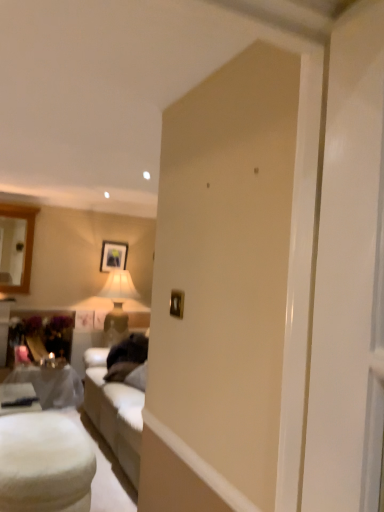
This screenshot has width=384, height=512. Identify the location of white fluffy ottoman at lower left, which is the first table from front to back. (44, 463).

The image size is (384, 512). In order to click on matte black picture frame at upper center, which ranks as the 2th picture frame in right-to-left order in this screenshot , I will do 113,256.

What are the coordinates of `white fluffy ottoman at lower left, which is counted as the 2th table, starting from the back` in the screenshot? It's located at (44, 463).

Based on the photo, from the image's perspective, does metallic gold picture frame at center, arranged as the 1th picture frame when viewed from the front, appear lower than matte black picture frame at upper center, which is the 1th picture frame in left-to-right order?

Yes, from the image's perspective, metallic gold picture frame at center, arranged as the 1th picture frame when viewed from the front, is below matte black picture frame at upper center, which is the 1th picture frame in left-to-right order.

Is metallic gold picture frame at center, which is the first picture frame in right-to-left order, outside of matte black picture frame at upper center, which ranks as the 2th picture frame in right-to-left order?

Yes, metallic gold picture frame at center, which is the first picture frame in right-to-left order, is located beyond the bounds of matte black picture frame at upper center, which ranks as the 2th picture frame in right-to-left order.

Is metallic gold picture frame at center, placed as the 2th picture frame when sorted from back to front, not near matte black picture frame at upper center, positioned as the 2th picture frame in front-to-back order?

Yes.

Considering the sizes of objects metallic gold picture frame at center, which is the first picture frame in right-to-left order, and matte black picture frame at upper center, the 1th picture frame from the back, in the image provided, who is wider, metallic gold picture frame at center, which is the first picture frame in right-to-left order, or matte black picture frame at upper center, the 1th picture frame from the back,?

With larger width is matte black picture frame at upper center, the 1th picture frame from the back.

Is matte black picture frame at upper center, which is the 1th picture frame in left-to-right order, in contact with matte gray table at lower left, the first table viewed from the back?

There is a gap between matte black picture frame at upper center, which is the 1th picture frame in left-to-right order, and matte gray table at lower left, the first table viewed from the back.

What's the angular difference between matte black picture frame at upper center, which ranks as the 2th picture frame in right-to-left order, and matte gray table at lower left, the first table viewed from the back,'s facing directions?

0.02 degrees.

From a real-world perspective, between matte black picture frame at upper center, the 1th picture frame from the back, and matte gray table at lower left, acting as the second table starting from the front, who is vertically lower?

In real-world perspective, matte gray table at lower left, acting as the second table starting from the front, is lower.

From the picture: Which point is more distant from viewer, (109, 254) or (24, 373)?

The point (109, 254) is behind.

Does white fluffy ottoman at lower left, which is the first table from front to back, have a larger size compared to matte gray table at lower left, acting as the second table starting from the front?

No, white fluffy ottoman at lower left, which is the first table from front to back, is not bigger than matte gray table at lower left, acting as the second table starting from the front.

Which of these two, white fluffy ottoman at lower left, which is counted as the 2th table, starting from the back, or matte gray table at lower left, acting as the second table starting from the front, stands taller?

matte gray table at lower left, acting as the second table starting from the front.

Between white fluffy ottoman at lower left, which is counted as the 2th table, starting from the back, and matte gray table at lower left, acting as the second table starting from the front, which one appears on the right side from the viewer's perspective?

white fluffy ottoman at lower left, which is counted as the 2th table, starting from the back, is more to the right.

Choose the correct answer: Is white fluffy ottoman at lower left, which is counted as the 2th table, starting from the back, inside matte gray table at lower left, the first table viewed from the back, or outside it?

white fluffy ottoman at lower left, which is counted as the 2th table, starting from the back, is not enclosed by matte gray table at lower left, the first table viewed from the back.

Is metallic gold picture frame at center, arranged as the 1th picture frame when viewed from the front, beside matte gray table at lower left, acting as the second table starting from the front?

metallic gold picture frame at center, arranged as the 1th picture frame when viewed from the front, and matte gray table at lower left, acting as the second table starting from the front, are clearly separated.

Can you confirm if metallic gold picture frame at center, placed as the 2th picture frame when sorted from left to right, is positioned to the left of matte gray table at lower left, the first table viewed from the back?

No, metallic gold picture frame at center, placed as the 2th picture frame when sorted from left to right, is not to the left of matte gray table at lower left, the first table viewed from the back.

Does metallic gold picture frame at center, placed as the 2th picture frame when sorted from back to front, have a lesser height compared to matte gray table at lower left, acting as the second table starting from the front?

Yes.

Which is behind, point (172, 294) or point (9, 373)?

The point (9, 373) is farther.

Considering the relative sizes of matte gray table at lower left, acting as the second table starting from the front, and matte black picture frame at upper center, positioned as the 2th picture frame in front-to-back order, in the image provided, is matte gray table at lower left, acting as the second table starting from the front, wider than matte black picture frame at upper center, positioned as the 2th picture frame in front-to-back order,?

Yes.

Considering the positions of objects matte gray table at lower left, acting as the second table starting from the front, and matte black picture frame at upper center, the 1th picture frame from the back, in the image provided, who is behind, matte gray table at lower left, acting as the second table starting from the front, or matte black picture frame at upper center, the 1th picture frame from the back,?

Positioned behind is matte black picture frame at upper center, the 1th picture frame from the back.

Which is more to the left, matte gray table at lower left, the first table viewed from the back, or matte black picture frame at upper center, which ranks as the 2th picture frame in right-to-left order?

matte gray table at lower left, the first table viewed from the back, is more to the left.

Which is closer, (x=79, y=382) or (x=112, y=254)?

The point (x=79, y=382) is more forward.

Based on the photo, does matte gray table at lower left, acting as the second table starting from the front, have a lesser width compared to white fluffy ottoman at lower left, which is counted as the 2th table, starting from the back?

Incorrect, the width of matte gray table at lower left, acting as the second table starting from the front, is not less than that of white fluffy ottoman at lower left, which is counted as the 2th table, starting from the back.

Measure the distance from matte gray table at lower left, acting as the second table starting from the front, to white fluffy ottoman at lower left, which is counted as the 2th table, starting from the back.

matte gray table at lower left, acting as the second table starting from the front, is 1.59 meters away from white fluffy ottoman at lower left, which is counted as the 2th table, starting from the back.

From a real-world perspective, which object stands above the other?

white fluffy ottoman at lower left, which is counted as the 2th table, starting from the back.

From the image's perspective, is matte gray table at lower left, acting as the second table starting from the front, over white fluffy ottoman at lower left, which is the first table from front to back?

Actually, matte gray table at lower left, acting as the second table starting from the front, appears below white fluffy ottoman at lower left, which is the first table from front to back, in the image.

Can metallic gold picture frame at center, placed as the 2th picture frame when sorted from back to front, be found inside white fluffy ottoman at lower left, which is the first table from front to back?

No, white fluffy ottoman at lower left, which is the first table from front to back, does not contain metallic gold picture frame at center, placed as the 2th picture frame when sorted from back to front.

Considering the sizes of objects white fluffy ottoman at lower left, which is the first table from front to back, and metallic gold picture frame at center, which is the first picture frame in right-to-left order, in the image provided, who is smaller, white fluffy ottoman at lower left, which is the first table from front to back, or metallic gold picture frame at center, which is the first picture frame in right-to-left order,?

Smaller between the two is metallic gold picture frame at center, which is the first picture frame in right-to-left order.

Is white fluffy ottoman at lower left, which is the first table from front to back, not near metallic gold picture frame at center, which is the first picture frame in right-to-left order?

Yes.

From the image's perspective, which one is positioned higher, white fluffy ottoman at lower left, which is the first table from front to back, or metallic gold picture frame at center, placed as the 2th picture frame when sorted from back to front?

metallic gold picture frame at center, placed as the 2th picture frame when sorted from back to front, appears higher in the image.

The width and height of the screenshot is (384, 512). Identify the location of picture frame that appears below the matte black picture frame at upper center, the 1th picture frame from the back (from a real-world perspective). (177, 303).

From a real-world perspective, starting from the matte gray table at lower left, the first table viewed from the back, which picture frame is the 2nd one vertically above it? Please provide its 2D coordinates.

[(113, 256)]

From the image, which object appears to be nearer to matte black picture frame at upper center, which ranks as the 2th picture frame in right-to-left order, white fluffy ottoman at lower left, which is counted as the 2th table, starting from the back, or matte gray table at lower left, the first table viewed from the back?

matte gray table at lower left, the first table viewed from the back, lies closer to matte black picture frame at upper center, which ranks as the 2th picture frame in right-to-left order, than the other object.

From the image, which object appears to be nearer to metallic gold picture frame at center, placed as the 2th picture frame when sorted from back to front, white fluffy ottoman at lower left, which is the first table from front to back, or matte gray table at lower left, acting as the second table starting from the front?

The object closer to metallic gold picture frame at center, placed as the 2th picture frame when sorted from back to front, is white fluffy ottoman at lower left, which is the first table from front to back.

When comparing their distances from metallic gold picture frame at center, arranged as the 1th picture frame when viewed from the front, does matte gray table at lower left, acting as the second table starting from the front, or white fluffy ottoman at lower left, which is the first table from front to back, seem further?

The object further to metallic gold picture frame at center, arranged as the 1th picture frame when viewed from the front, is matte gray table at lower left, acting as the second table starting from the front.

Based on their spatial positions, is matte gray table at lower left, acting as the second table starting from the front, or metallic gold picture frame at center, placed as the 2th picture frame when sorted from left to right, closer to white fluffy ottoman at lower left, which is the first table from front to back?

matte gray table at lower left, acting as the second table starting from the front, lies closer to white fluffy ottoman at lower left, which is the first table from front to back, than the other object.

Which object lies further to the anchor point metallic gold picture frame at center, which is the first picture frame in right-to-left order, white fluffy ottoman at lower left, which is the first table from front to back, or matte black picture frame at upper center, which ranks as the 2th picture frame in right-to-left order?

matte black picture frame at upper center, which ranks as the 2th picture frame in right-to-left order.

Which object lies further to the anchor point matte gray table at lower left, acting as the second table starting from the front, white fluffy ottoman at lower left, which is the first table from front to back, or metallic gold picture frame at center, which is the first picture frame in right-to-left order?

Based on the image, metallic gold picture frame at center, which is the first picture frame in right-to-left order, appears to be further to matte gray table at lower left, acting as the second table starting from the front.

From the image, which object appears to be nearer to matte gray table at lower left, the first table viewed from the back, matte black picture frame at upper center, the 1th picture frame from the back, or white fluffy ottoman at lower left, which is the first table from front to back?

white fluffy ottoman at lower left, which is the first table from front to back, is closer to matte gray table at lower left, the first table viewed from the back.

Based on their spatial positions, is metallic gold picture frame at center, placed as the 2th picture frame when sorted from back to front, or white fluffy ottoman at lower left, which is counted as the 2th table, starting from the back, further from matte gray table at lower left, acting as the second table starting from the front?

The object further to matte gray table at lower left, acting as the second table starting from the front, is metallic gold picture frame at center, placed as the 2th picture frame when sorted from back to front.

Where is `table between metallic gold picture frame at center, arranged as the 1th picture frame when viewed from the front, and matte gray table at lower left, acting as the second table starting from the front, from front to back`? table between metallic gold picture frame at center, arranged as the 1th picture frame when viewed from the front, and matte gray table at lower left, acting as the second table starting from the front, from front to back is located at coordinates (44, 463).

The height and width of the screenshot is (512, 384). Find the location of `table positioned between white fluffy ottoman at lower left, which is the first table from front to back, and matte black picture frame at upper center, positioned as the 2th picture frame in front-to-back order, from near to far`. table positioned between white fluffy ottoman at lower left, which is the first table from front to back, and matte black picture frame at upper center, positioned as the 2th picture frame in front-to-back order, from near to far is located at coordinates (51, 385).